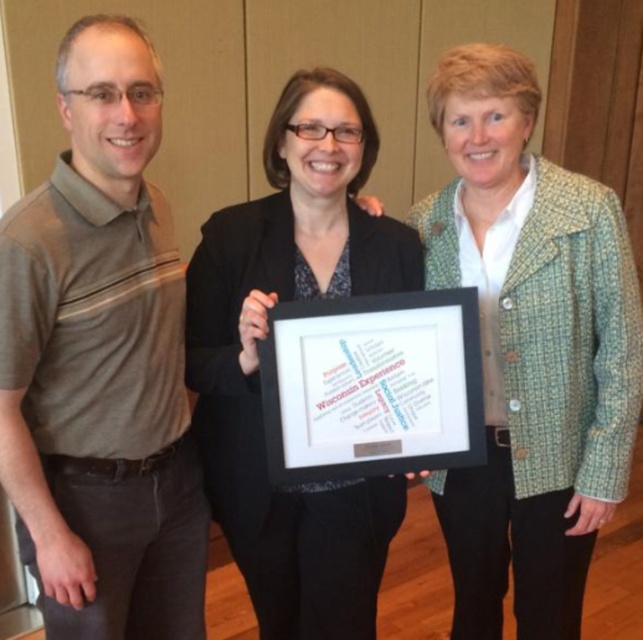
You are a photographer adjusting the lighting for a group photo. You notice two items at the center of the image, the green tweed blazer at center and the black fabric at center. Which item should you focus your spotlight on to highlight the taller object?

The green tweed blazer at center is taller than the black fabric at center, so you should focus the spotlight on the green tweed blazer at center to highlight the taller object.

You are a photographer adjusting your camera settings to focus on the green tweed blazer at center and the black fabric at center. Which object should you focus on first to ensure it appears sharp in the photo?

You should focus on the green tweed blazer at center first because it is closer to the viewer than the black fabric at center, so it requires proper focus to appear sharp.

You are a photographer trying to adjust the lighting for a group photo. You need to ensure that the gray striped polo shirt at left and the black fabric at center are evenly lit. Given their distance apart, is there enough space between them to place a small reflector between them?

The gray striped polo shirt at left is 23.14 centimeters from the black fabric at center. A small reflector typically requires about 15 centimeters of space to be effective. Since the distance between them is greater than 15 centimeters, there is enough space to place a small reflector between them for even lighting.